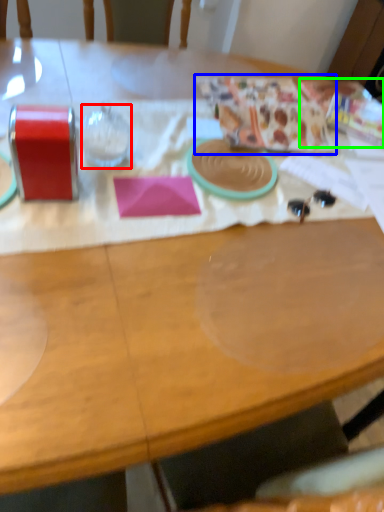
Question: Which object is the closest to the wine glass (highlighted by a red box)? Choose among these: wrapping paper (highlighted by a blue box) or wrapping paper (highlighted by a green box).

Choices:
 (A) wrapping paper
 (B) wrapping paper

Answer: (A)